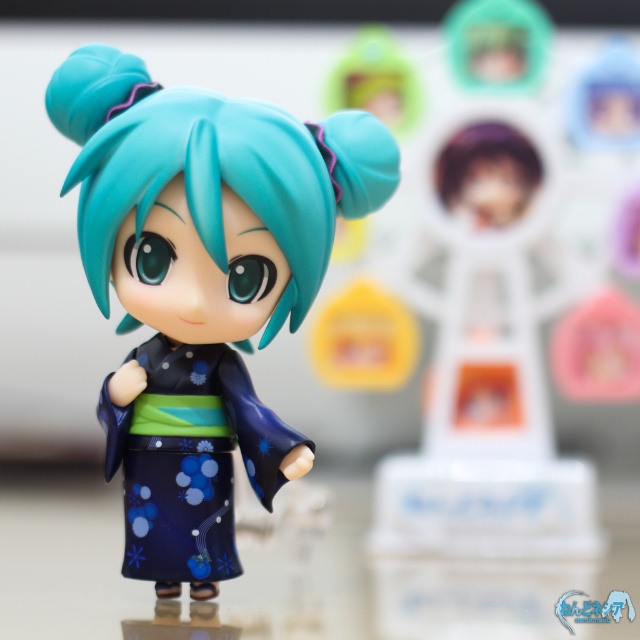
You are examining the figurine and want to determine which point is nearer to you. The points are point (125, 442) and point (445, 173). Which point is closer to you?

Point (125, 442) is closer to the viewer than point (445, 173).

You are an art curator arranging a display of figurines. You have two points marked on the wall where you can place items. The first point is at coordinates point (198, 465) and the second is at point (179, 378). You want to place the main figurine closer to the front of the display. Which coordinate should you choose?

Point (179, 378) should be chosen because point (198, 465) is behind it, making point (179, 378) the closer one to the front of the display.

You are standing in front of a display of Japanese figurines. You see a point marked at coordinates (202,285). Which object is located at this point?

The point at coordinates (202,285) marks the location of the matte blue kimono doll at center.